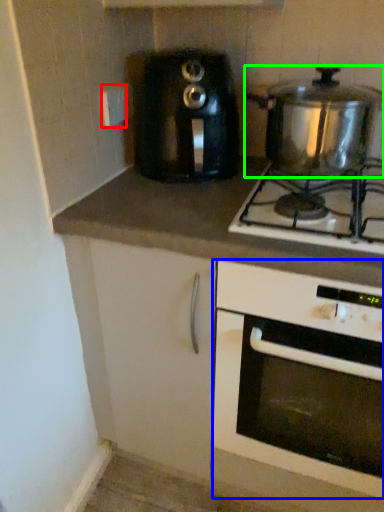
Question: Which object is positioned farthest from electric outlet (highlighted by a red box)? Select from oven (highlighted by a blue box) and kitchen appliance (highlighted by a green box).

Choices:
 (A) oven
 (B) kitchen appliance

Answer: (A)